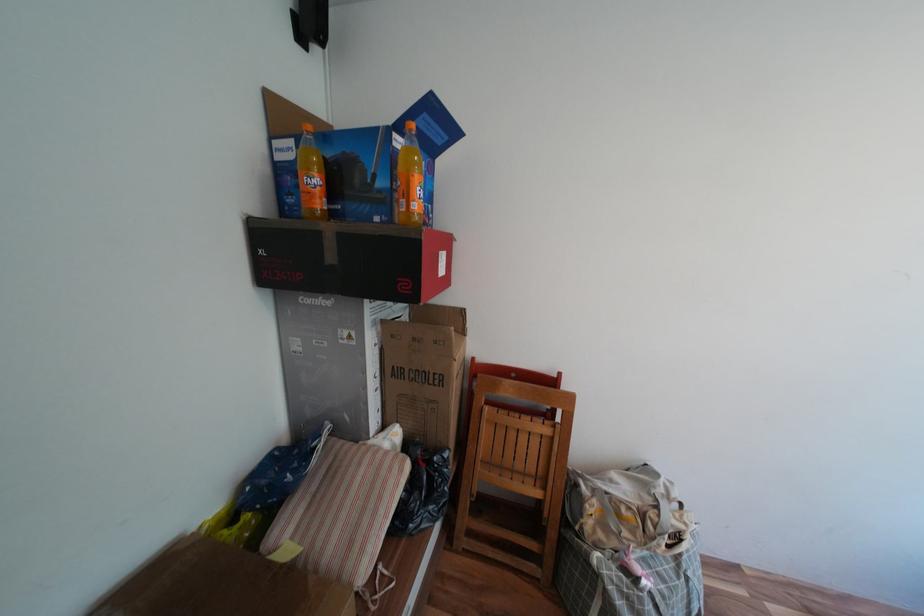
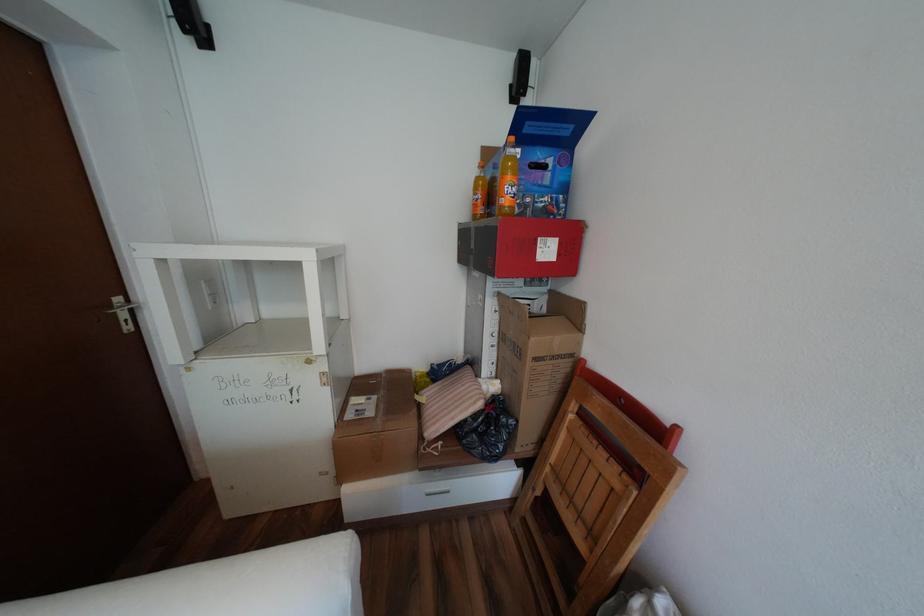
Where in the second image is the point corresponding to (434,115) from the first image?

(537, 123)